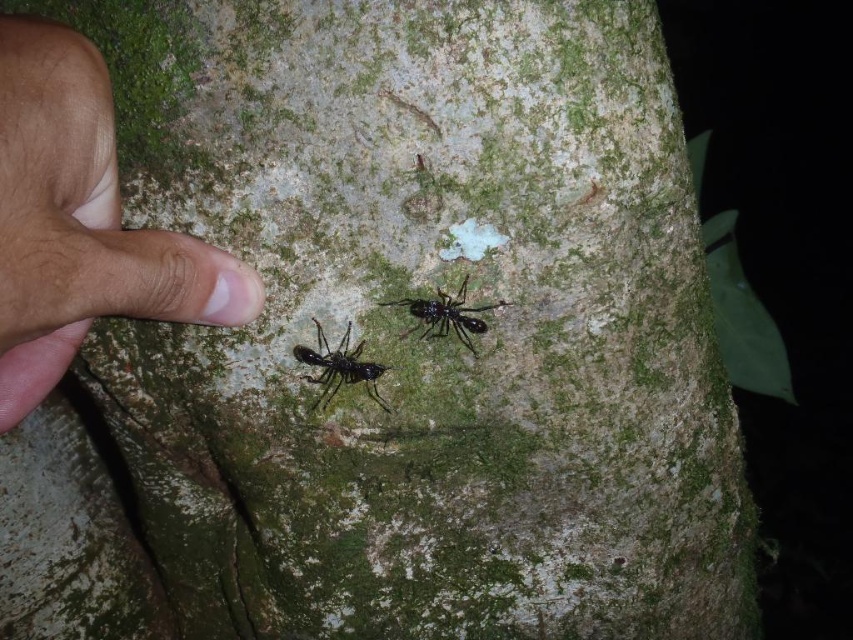
Question: Which object is positioned farthest from the brown skin at left?

Choices:
 (A) black glossy ant at center
 (B) black glossy ant at lower left

Answer: (A)

Question: Can you confirm if black glossy ant at lower left is wider than black glossy ant at center?

Choices:
 (A) no
 (B) yes

Answer: (A)

Question: Where is black glossy ant at lower left located in relation to black glossy ant at center in the image?

Choices:
 (A) left
 (B) right

Answer: (A)

Question: Which of the following is the closest to the observer?

Choices:
 (A) brown skin at left
 (B) black glossy ant at center
 (C) black glossy ant at lower left

Answer: (A)

Question: Which object appears farthest from the camera in this image?

Choices:
 (A) black glossy ant at lower left
 (B) black glossy ant at center

Answer: (A)

Question: In this image, where is brown skin at left located relative to black glossy ant at center?

Choices:
 (A) above
 (B) below

Answer: (A)